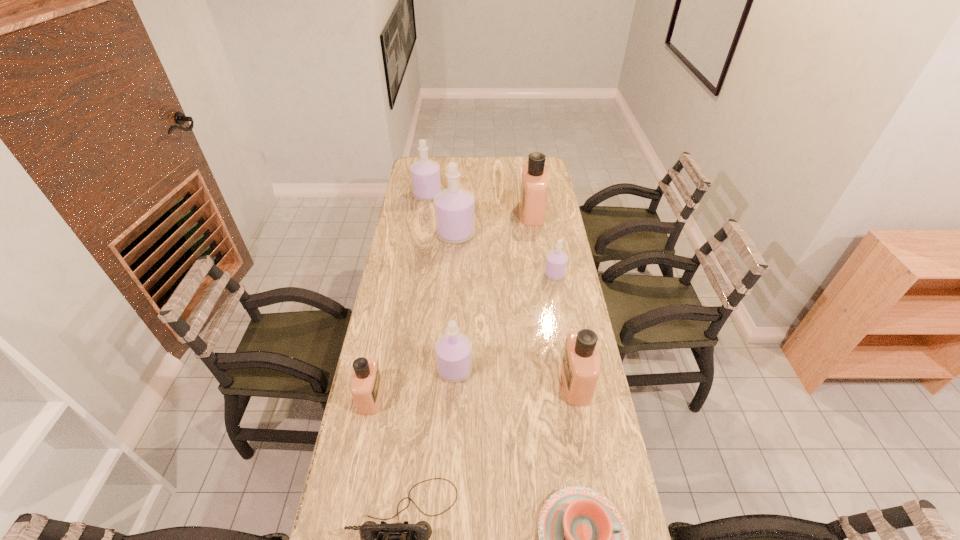
At what (x,y) coordinates should I click in order to perform the action: click on object that stands as the closest to the chinaware. Please return your answer as a coordinate pair (x, y). This screenshot has height=540, width=960. Looking at the image, I should click on (397, 539).

The image size is (960, 540). In order to click on the fourth closest object relative to the telephone in this screenshot , I will do `click(580, 367)`.

Find the location of `the fifth closest perfume to the smallest purple perfume`. the fifth closest perfume to the smallest purple perfume is located at coordinates (425, 174).

Locate which perfume ranks fourth in proximity to the second smallest beige perfume. Please provide its 2D coordinates. Your answer should be formatted as a tuple, i.e. [(x, y)], where the tuple contains the x and y coordinates of a point satisfying the conditions above.

[(454, 207)]

Identify which purple perfume is the fourth closest to the smallest beige perfume. Please provide its 2D coordinates. Your answer should be formatted as a tuple, i.e. [(x, y)], where the tuple contains the x and y coordinates of a point satisfying the conditions above.

[(425, 174)]

Image resolution: width=960 pixels, height=540 pixels. Find the location of `purple perfume that can be found as the third closest to the rightmost purple perfume`. purple perfume that can be found as the third closest to the rightmost purple perfume is located at coordinates (425, 174).

Locate which beige perfume is the second closest to the second biggest beige perfume. Please provide its 2D coordinates. Your answer should be formatted as a tuple, i.e. [(x, y)], where the tuple contains the x and y coordinates of a point satisfying the conditions above.

[(534, 186)]

Locate which beige perfume is the closest to the nearest purple perfume. Please provide its 2D coordinates. Your answer should be formatted as a tuple, i.e. [(x, y)], where the tuple contains the x and y coordinates of a point satisfying the conditions above.

[(366, 385)]

Locate an element on the screen. This screenshot has width=960, height=540. free space that satisfies the following two spatial constraints: 1. on the back side of the smallest purple perfume; 2. on the front label of the biggest beige perfume is located at coordinates (543, 212).

I want to click on free space that satisfies the following two spatial constraints: 1. on the front side of the second biggest purple perfume; 2. on the front label of the leftmost beige perfume, so click(396, 397).